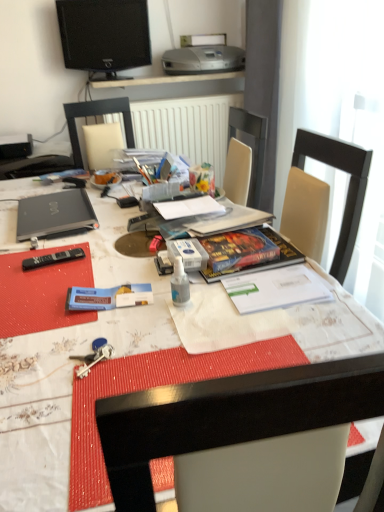
The height and width of the screenshot is (512, 384). In order to click on vacant space that is to the left of transparent plastic spray bottle at center in this screenshot , I will do `click(116, 306)`.